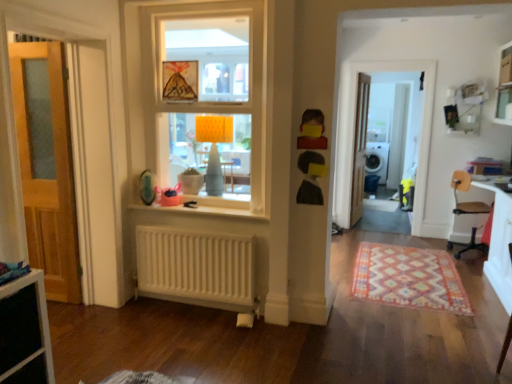
Question: Can you confirm if white matte radiator at lower center is bigger than pink fabric toy at center, placed as the 3th toy when sorted from front to back?

Choices:
 (A) no
 (B) yes

Answer: (B)

Question: Is white matte radiator at lower center at the right side of pink fabric toy at center, the 3th toy from the right?

Choices:
 (A) yes
 (B) no

Answer: (A)

Question: Does white matte radiator at lower center have a greater height compared to pink fabric toy at center, placed as the 3th toy when sorted from front to back?

Choices:
 (A) no
 (B) yes

Answer: (B)

Question: Does white matte radiator at lower center lie behind pink fabric toy at center, the first toy positioned from the back?

Choices:
 (A) no
 (B) yes

Answer: (A)

Question: Is white matte radiator at lower center next to pink fabric toy at center, placed as the 3th toy when sorted from front to back, and touching it?

Choices:
 (A) no
 (B) yes

Answer: (A)

Question: Is white matte radiator at lower center facing away from pink fabric toy at center, placed as the 3th toy when sorted from front to back?

Choices:
 (A) no
 (B) yes

Answer: (A)

Question: From the image's perspective, does matte black toy at center, marked as the 3th toy in a left-to-right arrangement, appear lower than yellow paper picture frame at upper center?

Choices:
 (A) yes
 (B) no

Answer: (A)

Question: Is matte black toy at center, marked as the 3th toy in a left-to-right arrangement, not within yellow paper picture frame at upper center?

Choices:
 (A) yes
 (B) no

Answer: (A)

Question: Is matte black toy at center, which is counted as the second toy, starting from the front, aimed at yellow paper picture frame at upper center?

Choices:
 (A) no
 (B) yes

Answer: (A)

Question: From the image's perspective, is matte black toy at center, which is counted as the 1th toy, starting from the right, over yellow paper picture frame at upper center?

Choices:
 (A) yes
 (B) no

Answer: (B)

Question: Does matte black toy at center, which is counted as the second toy, starting from the front, have a greater height compared to yellow paper picture frame at upper center?

Choices:
 (A) no
 (B) yes

Answer: (B)

Question: Considering the relative sizes of matte black toy at center, which is the second toy from back to front, and yellow paper picture frame at upper center in the image provided, is matte black toy at center, which is the second toy from back to front, bigger than yellow paper picture frame at upper center?

Choices:
 (A) yes
 (B) no

Answer: (B)

Question: Considering the relative sizes of white plastic chair at right and white glossy screen door at center, arranged as the second screen door when viewed from the front, in the image provided, is white plastic chair at right shorter than white glossy screen door at center, arranged as the second screen door when viewed from the front,?

Choices:
 (A) yes
 (B) no

Answer: (A)